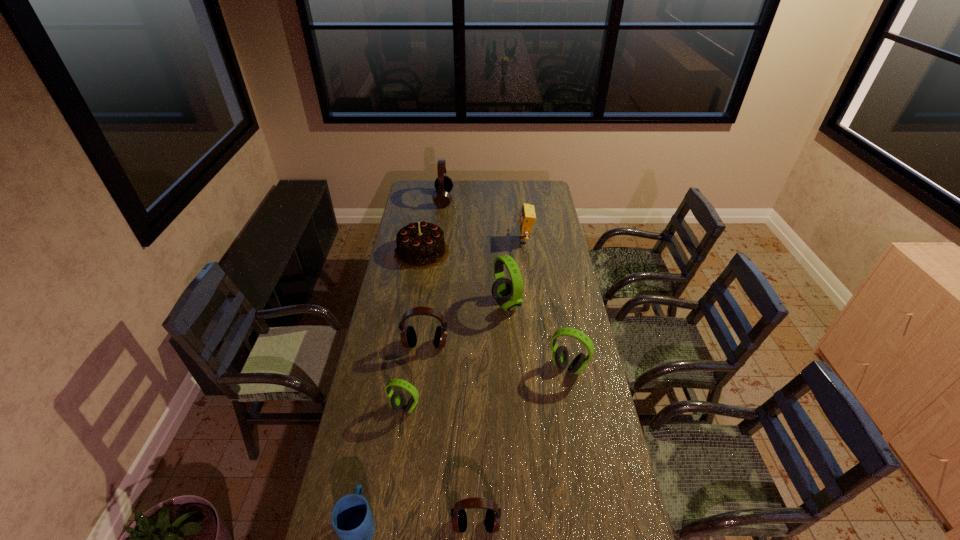
Find the location of `the seventh farthest object`. the seventh farthest object is located at coordinates (397, 399).

In order to click on the smallest green headset in this screenshot , I will do `click(397, 399)`.

Where is `the nearest black headset`? This screenshot has width=960, height=540. the nearest black headset is located at coordinates (458, 514).

Find the location of a particular element. The image size is (960, 540). the smallest black headset is located at coordinates (458, 514).

Image resolution: width=960 pixels, height=540 pixels. I want to click on vacant area situated on the ear pads of the farthest headset, so click(x=504, y=199).

Locate an element on the screen. The width and height of the screenshot is (960, 540). vacant space situated on the left of the biggest green headset is located at coordinates (437, 303).

The image size is (960, 540). Identify the location of vacant point located on the ear pads of the fourth nearest headset. (414, 443).

You are a GUI agent. You are given a task and a screenshot of the screen. Output one action in this format:
    pyautogui.click(x=<x>, y=<y>)
    Task: Click on the vacant position located on the back of the rightmost green headset
    This screenshot has width=960, height=540.
    Given the screenshot: What is the action you would take?
    pyautogui.click(x=556, y=303)

This screenshot has width=960, height=540. I want to click on blank space located on the face of the sponge, so click(497, 241).

What are the coordinates of `vacant region located on the face of the sponge` in the screenshot? It's located at (457, 241).